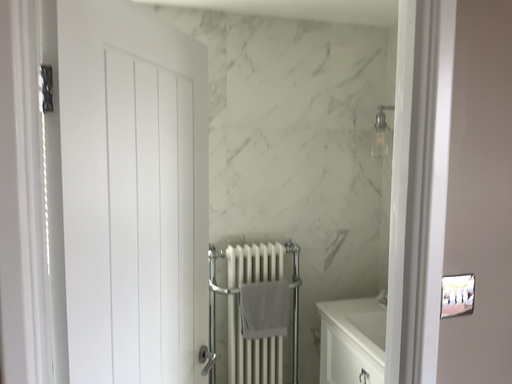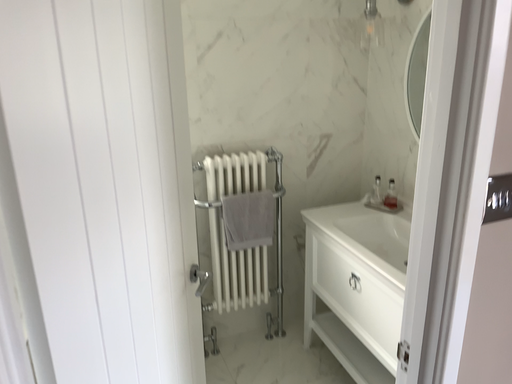
Question: How did the camera likely rotate when shooting the video?

Choices:
 (A) rotated downward
 (B) rotated upward

Answer: (A)